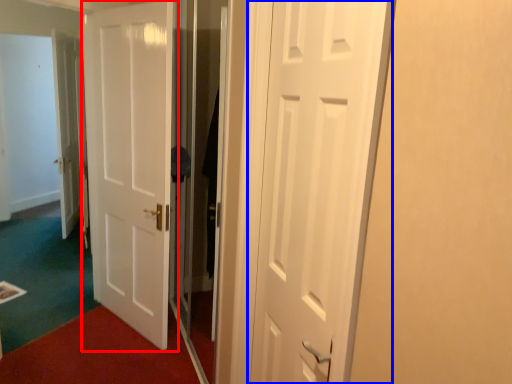
Question: Which object appears closest to the camera in this image, door (highlighted by a red box) or door (highlighted by a blue box)?

Choices:
 (A) door
 (B) door

Answer: (B)